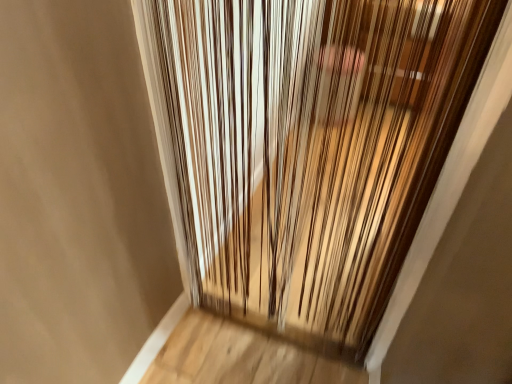
Question: Should I look upward or downward to see metallic thread curtain at center?

Choices:
 (A) down
 (B) up

Answer: (A)